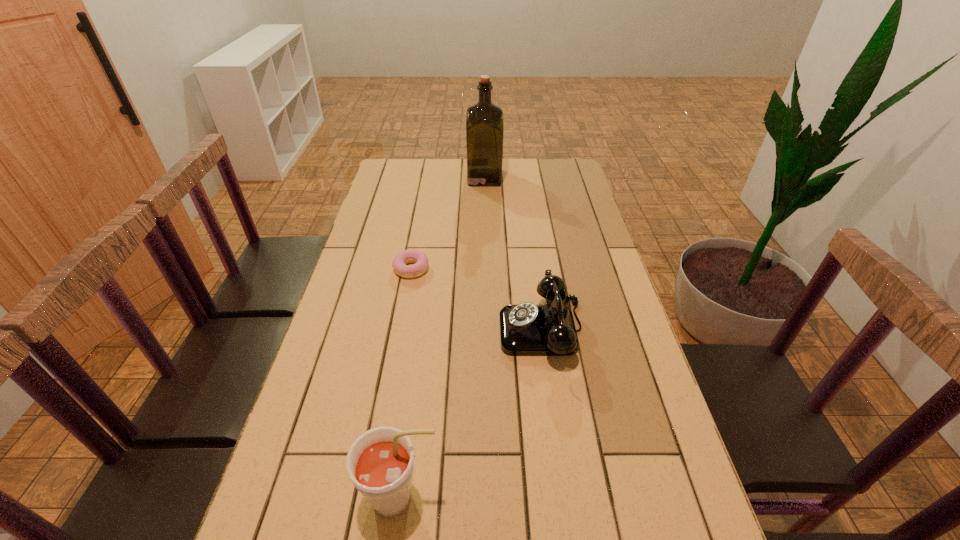
Where is `liquor`? The height and width of the screenshot is (540, 960). liquor is located at coordinates (484, 121).

Where is `the tallest object`? The height and width of the screenshot is (540, 960). the tallest object is located at coordinates (484, 121).

You are a GUI agent. You are given a task and a screenshot of the screen. Output one action in this format:
    pyautogui.click(x=<x>, y=<y>)
    Task: Click on the third shortest object
    The height and width of the screenshot is (540, 960).
    Given the screenshot: What is the action you would take?
    pyautogui.click(x=380, y=463)

Locate an element on the screen. the nearest object is located at coordinates (380, 463).

Where is `the third farthest object`? The height and width of the screenshot is (540, 960). the third farthest object is located at coordinates (526, 329).

What are the coordinates of `telephone` in the screenshot? It's located at (526, 329).

The height and width of the screenshot is (540, 960). Find the location of `the third nearest object`. the third nearest object is located at coordinates (420, 259).

At what (x,y) coordinates should I click in order to perform the action: click on doughnut. Please return your answer as a coordinate pair (x, y). The width and height of the screenshot is (960, 540). Looking at the image, I should click on (420, 259).

Where is `blank space located 0.190m on the label of the liquor`? This screenshot has width=960, height=540. blank space located 0.190m on the label of the liquor is located at coordinates (421, 178).

At what (x,y) coordinates should I click in order to perform the action: click on vacant region located 0.090m on the label of the liquor. Please return your answer as a coordinate pair (x, y). The width and height of the screenshot is (960, 540). Looking at the image, I should click on (445, 178).